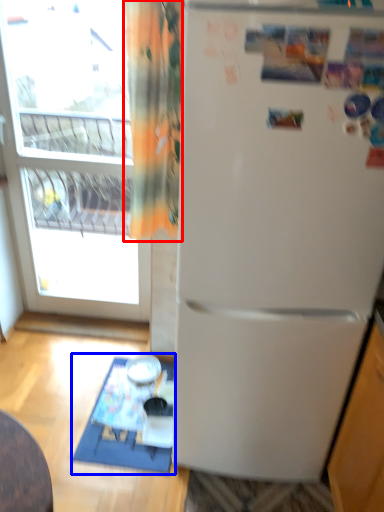
Question: Which of the following is the farthest to the observer, curtain (highlighted by a red box) or table (highlighted by a blue box)?

Choices:
 (A) curtain
 (B) table

Answer: (B)